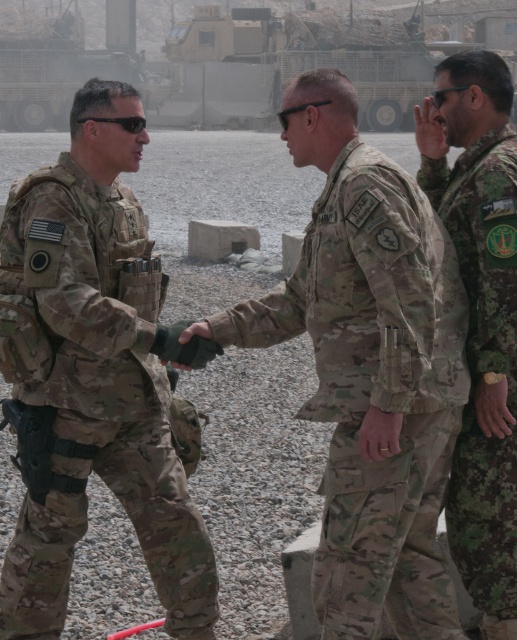
You are a drone operator observing a military base. You need to locate the camouflage uniform at center. According to the coordinates provided, where would you direct your camera to find it?

The camouflage uniform at center is located at point (x=96, y=380), so direct the camera to that coordinate to find it.

Based on the photo, you are a photographer positioned at the back of the scene. You need to capture both the camouflage uniform at center and the camouflage fabric uniform at center in a single shot. Which object should you focus on first to ensure both are in frame?

You should focus on the camouflage fabric uniform at center first because it occupies more space than the camouflage uniform at center, ensuring it fits within the frame while also capturing the smaller one.